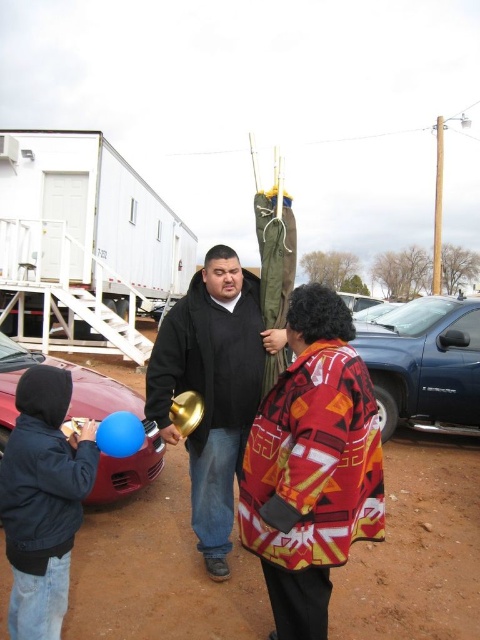
Question: Among these objects, which one is nearest to the camera?

Choices:
 (A) brown dirt field at center
 (B) blue metallic truck at lower right
 (C) navy blue jacket at lower left
 (D) shiny red car at lower left

Answer: (C)

Question: Which of the following is the closest to the observer?

Choices:
 (A) (178, 552)
 (B) (228, 364)

Answer: (B)

Question: Does black matte jacket at center come in front of navy blue jacket at lower left?

Choices:
 (A) no
 (B) yes

Answer: (A)

Question: Can you confirm if brown dirt field at center is positioned below blue metallic truck at lower right?

Choices:
 (A) yes
 (B) no

Answer: (A)

Question: Estimate the real-world distances between objects in this image. Which object is farther from the brown dirt field at center?

Choices:
 (A) shiny red car at lower left
 (B) navy blue jacket at lower left
 (C) black matte jacket at center

Answer: (A)

Question: Does navy blue jacket at lower left have a smaller size compared to shiny red car at lower left?

Choices:
 (A) yes
 (B) no

Answer: (A)